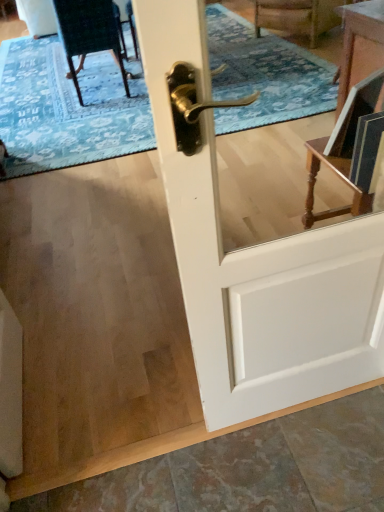
Question: Is velvet dark green chair at upper left bigger or smaller than blue textured rug at upper center?

Choices:
 (A) small
 (B) big

Answer: (A)

Question: From a real-world perspective, is velvet dark green chair at upper left physically located above or below blue textured rug at upper center?

Choices:
 (A) above
 (B) below

Answer: (A)

Question: Which of these objects is positioned closest to the blue textured rug at upper center?

Choices:
 (A) velvet dark green chair at upper left
 (B) white glossy door at center

Answer: (A)

Question: Estimate the real-world distances between objects in this image. Which object is closer to the blue textured rug at upper center?

Choices:
 (A) velvet dark green chair at upper left
 (B) white glossy door at center

Answer: (A)